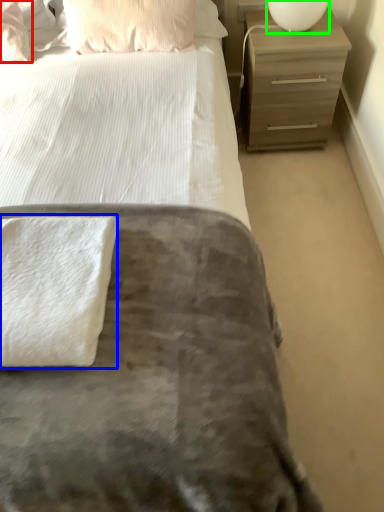
Question: Which object is the closest to the pillow (highlighted by a red box)? Choose among these: bath towel (highlighted by a blue box) or bedside lamp (highlighted by a green box).

Choices:
 (A) bath towel
 (B) bedside lamp

Answer: (B)